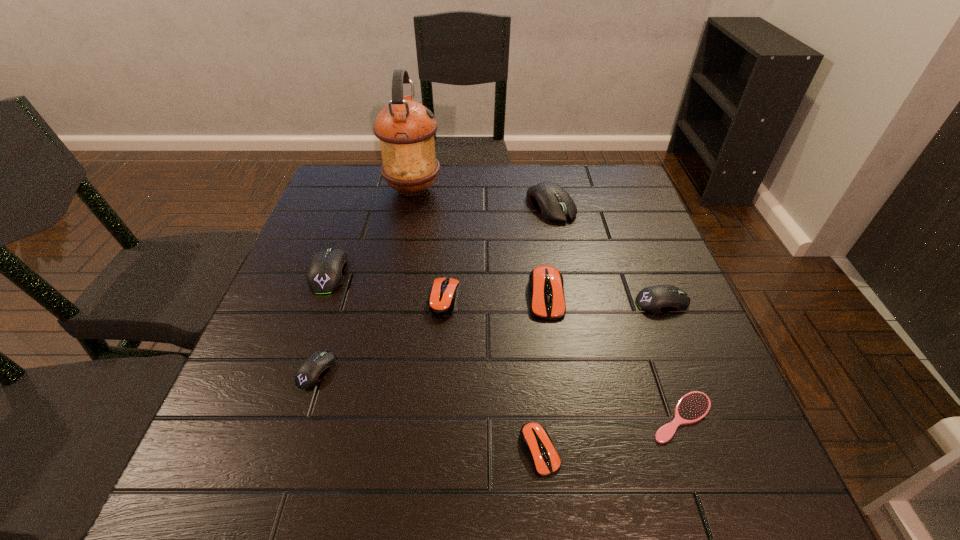
At what (x,y) coordinates should I click in order to perform the action: click on oil lamp. Please return your answer as a coordinate pair (x, y). This screenshot has height=540, width=960. Looking at the image, I should click on (405, 128).

This screenshot has height=540, width=960. In order to click on the eighth shortest object in this screenshot , I will do `click(549, 198)`.

At what (x,y) coordinates should I click in order to perform the action: click on the second black computer equipment from right to left. Please return your answer as a coordinate pair (x, y). Looking at the image, I should click on (549, 198).

At what (x,y) coordinates should I click in order to perform the action: click on the third smallest black computer equipment. Please return your answer as a coordinate pair (x, y). The height and width of the screenshot is (540, 960). Looking at the image, I should click on (326, 272).

The image size is (960, 540). Identify the location of the biggest orange computer mouse. pos(546,284).

Identify the location of the rightmost computer mouse. (656, 299).

You are a GUI agent. You are given a task and a screenshot of the screen. Output one action in this format:
    pyautogui.click(x=<x>, y=<y>)
    Task: Click on the third biggest black computer equipment
    Image resolution: width=960 pixels, height=540 pixels.
    Given the screenshot: What is the action you would take?
    coord(656,299)

Identify the location of the second smallest orange computer mouse. (441, 302).

Image resolution: width=960 pixels, height=540 pixels. I want to click on the leftmost orange computer mouse, so tap(441, 302).

You are a GUI agent. You are given a task and a screenshot of the screen. Output one action in this format:
    pyautogui.click(x=<x>, y=<y>)
    Task: Click on the third nearest object
    The width and height of the screenshot is (960, 540).
    Given the screenshot: What is the action you would take?
    click(309, 374)